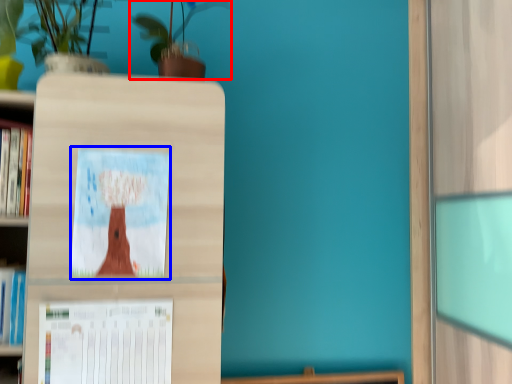
Question: Which object appears closest to the camera in this image, houseplant (highlighted by a red box) or picture frame (highlighted by a blue box)?

Choices:
 (A) houseplant
 (B) picture frame

Answer: (B)